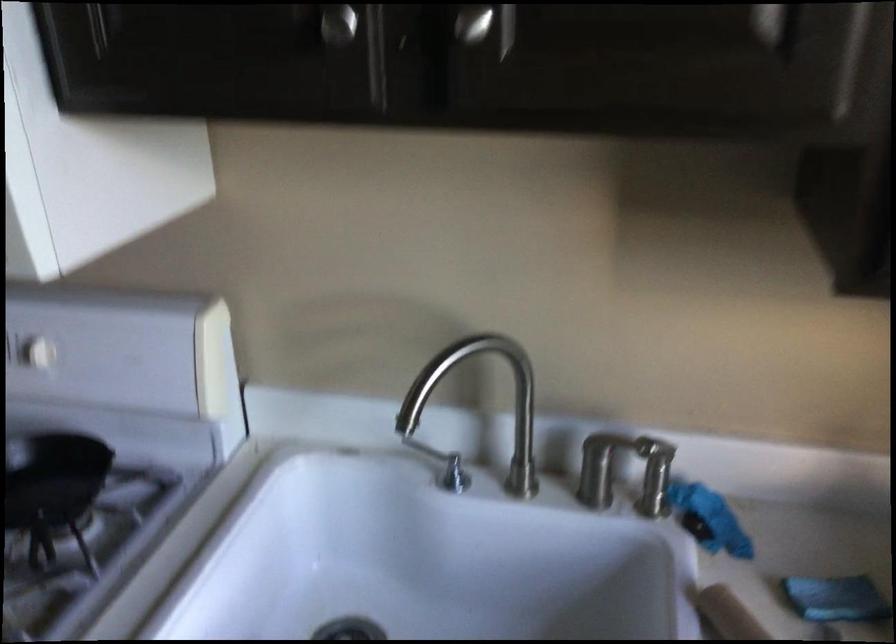
Locate an element on the screen. This screenshot has width=896, height=644. white stove knob is located at coordinates point(37,352).